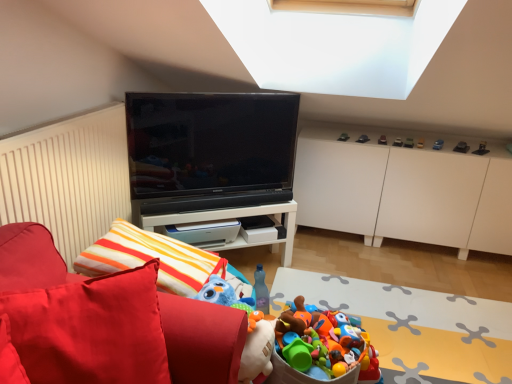
Question: From the image's perspective, is metallic silver toy car at upper right, acting as the 3th toy starting from the left, positioned above or below metallic silver toy car at upper right, the 3th toy when ordered from top to bottom?

Choices:
 (A) below
 (B) above

Answer: (B)

Question: From a real-world perspective, relative to metallic silver toy car at upper right, which ranks as the 5th toy in left-to-right order, is metallic silver toy car at upper right, the eleventh toy when ordered from bottom to top, vertically above or below?

Choices:
 (A) above
 (B) below

Answer: (B)

Question: Which object is positioned closest to the plastic toy bucket at lower center, which is the tenth toy in right-to-left order?

Choices:
 (A) metallic gold car at upper right, which is counted as the 8th toy, starting from the left
 (B) metallic gray toy car at upper right, the eighth toy from the top
 (C) metallic car at upper center, which is the second toy from top to bottom
 (D) plastic toy bucket at lower center
 (E) metallic black toy car at upper right, the 3th toy ordered from the bottom

Answer: (D)

Question: Which is farther from the black glossy tv at center?

Choices:
 (A) plastic toy bucket at lower center
 (B) metallic black toy car at upper right, marked as the 9th toy in a top-to-bottom arrangement
 (C) metallic red car at upper right, arranged as the 6th toy when viewed from the right
 (D) metallic gold car at upper right, which is counted as the 8th toy, starting from the left
 (E) metallic silver toy car at upper right, which appears as the 1th toy when viewed from the top

Answer: (B)